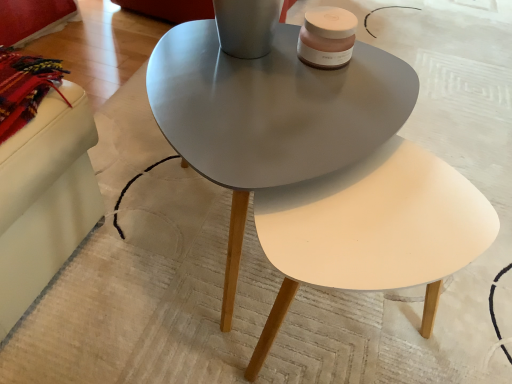
In order to face matte gray coffee table at center, should I rotate leftwards or rightwards?

Turn right by 4.819 degrees to look at matte gray coffee table at center.

At what (x,y) coordinates should I click in order to perform the action: click on matte gray coffee table at center. Please return your answer as a coordinate pair (x, y). Looking at the image, I should click on (317, 168).

What do you see at coordinates (317, 168) in the screenshot?
I see `matte gray coffee table at center` at bounding box center [317, 168].

Where is `matte gray coffee table at center`? matte gray coffee table at center is located at coordinates (317, 168).